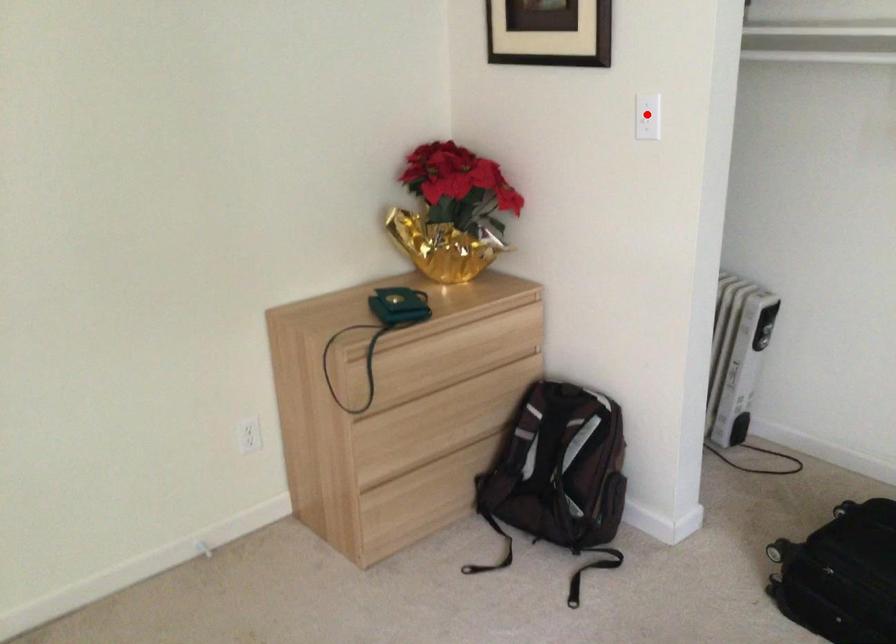
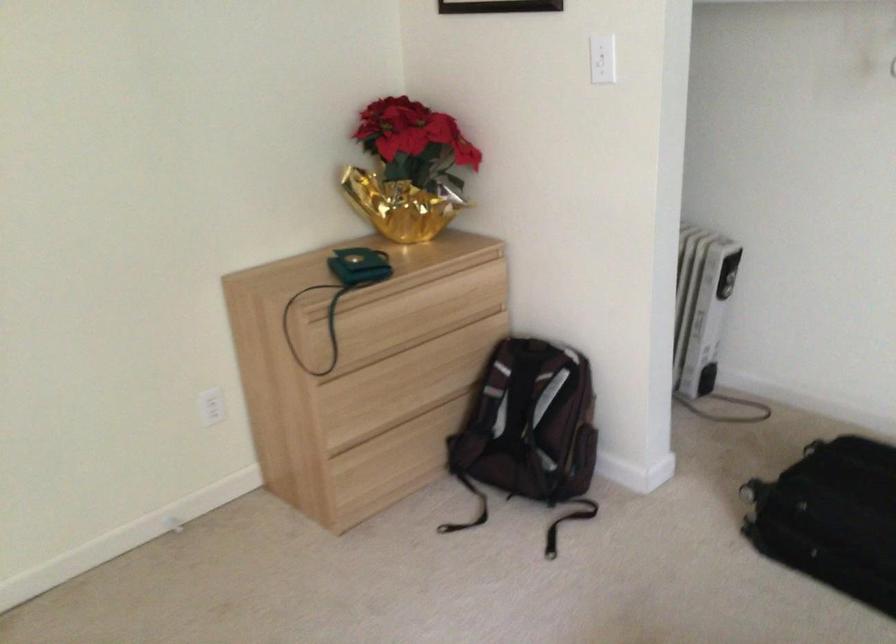
Find the pixel in the second image that matches the highlighted location in the first image.

(602, 59)